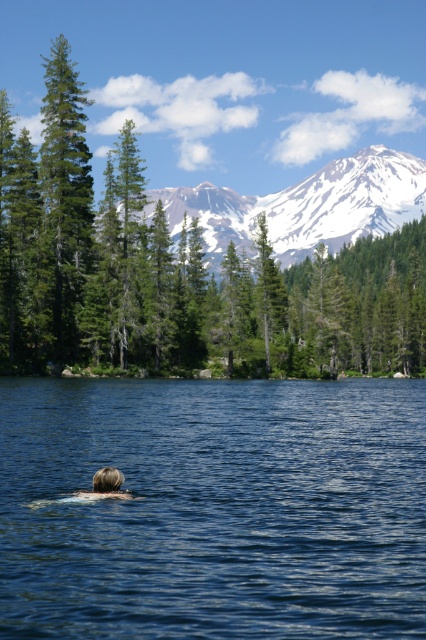
You are standing at the edge of the water in the serene natural scene. There is a point marked at coordinates (x=213, y=509). What is the location of this point relative to the blue liquid water at center?

The point at (x=213, y=509) is located on the blue liquid water at center.

You are an observer standing at the edge of the water. Which object is closer to you, the blue liquid water at center or the snowy mountain at upper center?

The blue liquid water at center is closer to you since it is located below the snowy mountain at upper center, placing it nearer in the scene.